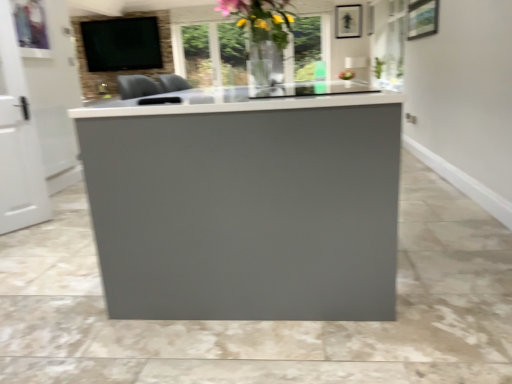
Question: Does green leafy plant at upper right have a lesser width compared to translucent glass vase at upper center?

Choices:
 (A) no
 (B) yes

Answer: (B)

Question: From a real-world perspective, is green leafy plant at upper right positioned under translucent glass vase at upper center based on gravity?

Choices:
 (A) no
 (B) yes

Answer: (B)

Question: Can you confirm if green leafy plant at upper right is wider than translucent glass vase at upper center?

Choices:
 (A) no
 (B) yes

Answer: (A)

Question: Does green leafy plant at upper right appear on the right side of translucent glass vase at upper center?

Choices:
 (A) no
 (B) yes

Answer: (B)

Question: Is green leafy plant at upper right further to camera compared to translucent glass vase at upper center?

Choices:
 (A) no
 (B) yes

Answer: (B)

Question: Is green leafy plant at upper right taller than translucent glass vase at upper center?

Choices:
 (A) no
 (B) yes

Answer: (A)

Question: Is matte black tv at upper left in contact with translucent glass vase at upper center?

Choices:
 (A) yes
 (B) no

Answer: (B)

Question: Does matte black tv at upper left have a greater height compared to translucent glass vase at upper center?

Choices:
 (A) no
 (B) yes

Answer: (B)

Question: Considering the relative sizes of matte black tv at upper left and translucent glass vase at upper center in the image provided, is matte black tv at upper left thinner than translucent glass vase at upper center?

Choices:
 (A) no
 (B) yes

Answer: (B)

Question: Would you say matte black tv at upper left is outside translucent glass vase at upper center?

Choices:
 (A) yes
 (B) no

Answer: (A)

Question: From the image's perspective, is matte black tv at upper left under translucent glass vase at upper center?

Choices:
 (A) no
 (B) yes

Answer: (A)

Question: Can you confirm if matte black tv at upper left is positioned to the right of translucent glass vase at upper center?

Choices:
 (A) no
 (B) yes

Answer: (A)

Question: Is the depth of green leafy plant at upper right less than that of white glossy door at left?

Choices:
 (A) yes
 (B) no

Answer: (B)